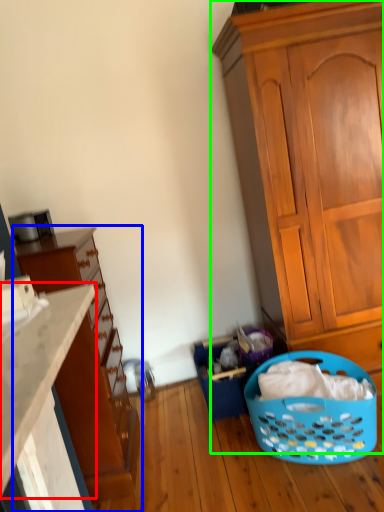
Question: Which is nearer to the countertop (highlighted by a red box)? cupboard (highlighted by a blue box) or cabinetry (highlighted by a green box).

Choices:
 (A) cupboard
 (B) cabinetry

Answer: (A)